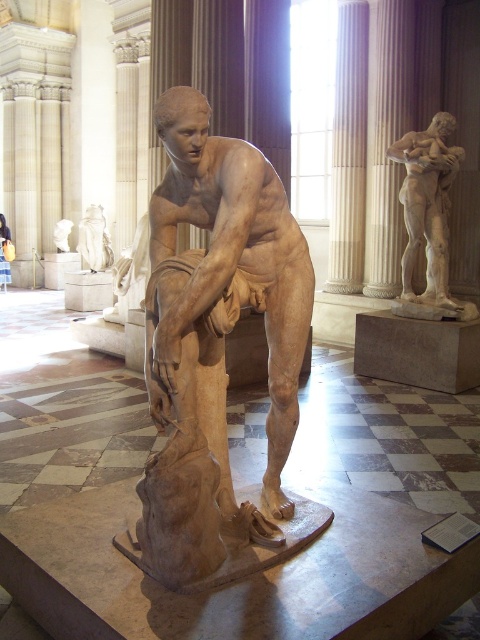
Which is below, white marble statue at upper right or white marble statue at center?

white marble statue at upper right is lower down.

Is white marble statue at upper right to the right of white marble statue at center from the viewer's perspective?

Yes, white marble statue at upper right is to the right of white marble statue at center.

Between point (411, 237) and point (62, 218), which one is positioned behind?

Positioned behind is point (62, 218).

Where is `white marble statue at upper right`? This screenshot has width=480, height=640. white marble statue at upper right is located at coordinates (428, 204).

Can you confirm if white marble column at center is shorter than white marble statue at upper right?

Yes, white marble column at center is shorter than white marble statue at upper right.

Is point (356, 29) positioned in front of point (430, 236)?

No, (356, 29) is behind (430, 236).

Find the location of a particular element. The height and width of the screenshot is (640, 480). white marble column at center is located at coordinates (348, 150).

Which is more to the left, matte stone statue at center or white marble column at center?

Positioned to the left is matte stone statue at center.

Is matte stone statue at center behind white marble column at center?

No, matte stone statue at center is in front of white marble column at center.

Between point (197, 522) and point (340, 280), which one is positioned in front?

Point (197, 522) is more forward.

Identify the location of matte stone statue at center. (215, 339).